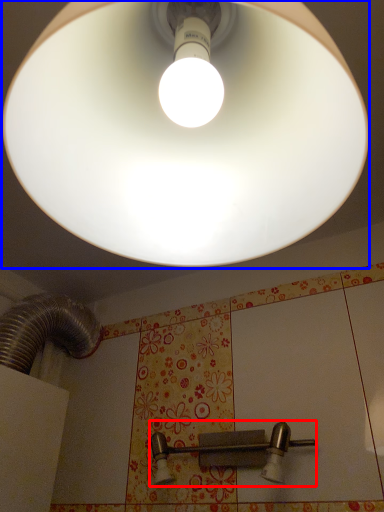
Question: Which object appears closest to the camera in this image, door handle (highlighted by a red box) or lamp (highlighted by a blue box)?

Choices:
 (A) door handle
 (B) lamp

Answer: (B)